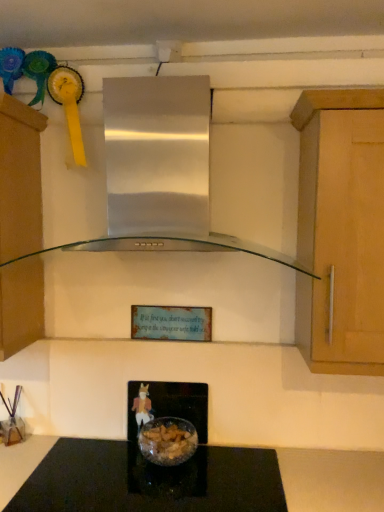
At what (x,y) coordinates should I click in order to perform the action: click on vacant area to the right of translucent glass bowl at center. Please return your answer as a coordinate pair (x, y). The width and height of the screenshot is (384, 512). Looking at the image, I should click on (214, 458).